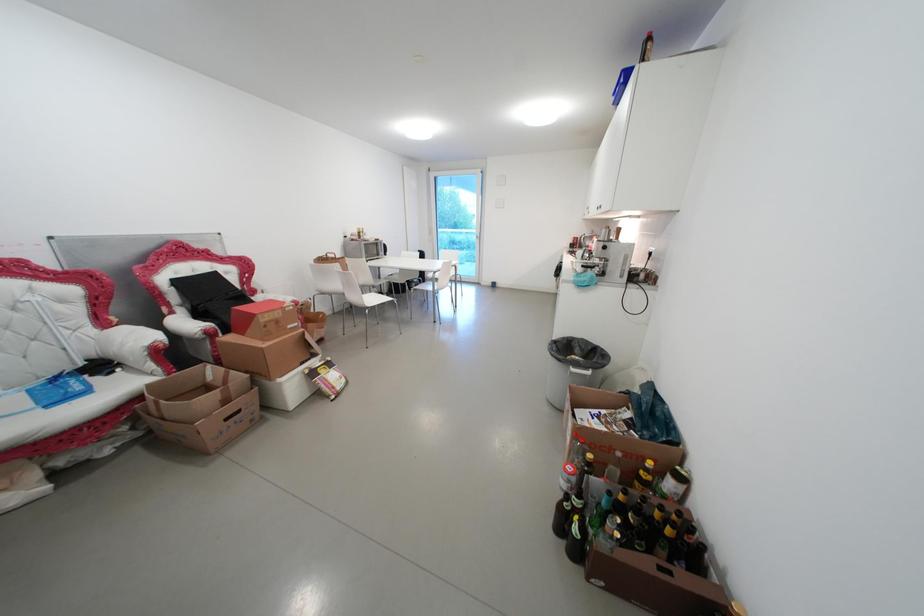
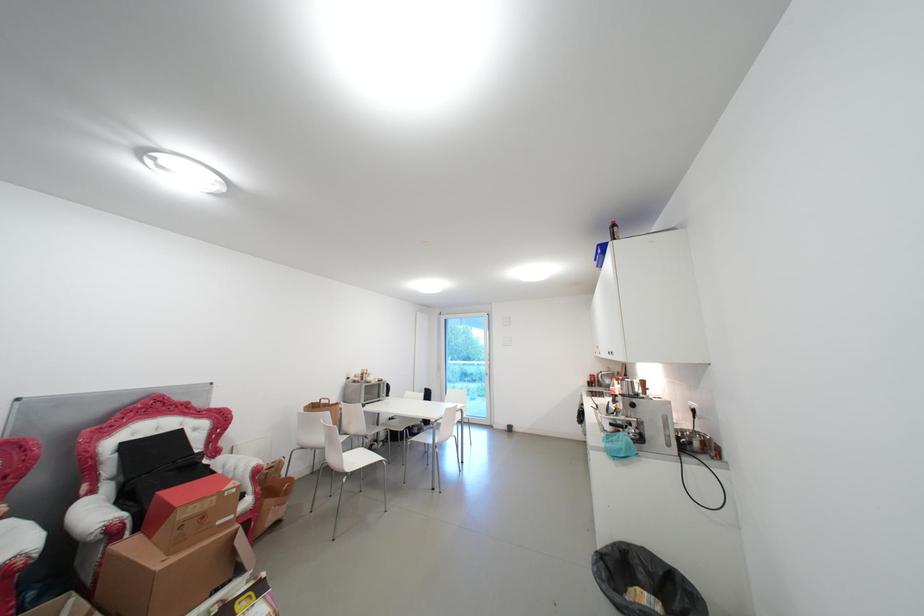
Question: Based on the continuous images, in which direction is the camera rotating? Reply with the corresponding letter.

Choices:
 (A) Left
 (B) Right
 (C) Up
 (D) Down

Answer: (C)